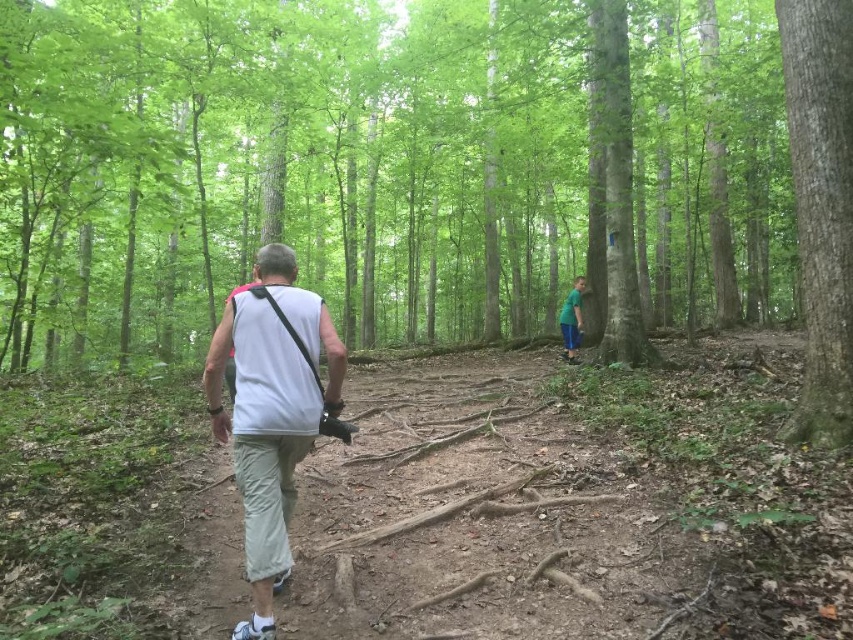
You are standing at the point closer to the camera in the forest scene. Which point are you at, point (641, 172) or point (805, 54)?

You are at point (641, 172) because it is closer to the camera than point (805, 54).

You are a photographer trying to capture a clear image of the person in the white fabric shirt at center and the green fabric shirt at center. Which shirt will appear smaller in your photo?

The white fabric shirt at center will appear smaller in the photo because it has a smaller size compared to the green fabric shirt at center.

You are a hiker trying to take a photo of both the smooth bark tree at center and the smooth bark tree at right. Since you have a wide angle lens, which tree should you stand closer to in order to capture both in the frame?

You should stand closer to the smooth bark tree at right because it is smaller than the smooth bark tree at center. By positioning yourself nearer to the smaller tree, you can include both trees within the frame while maintaining their relative sizes.